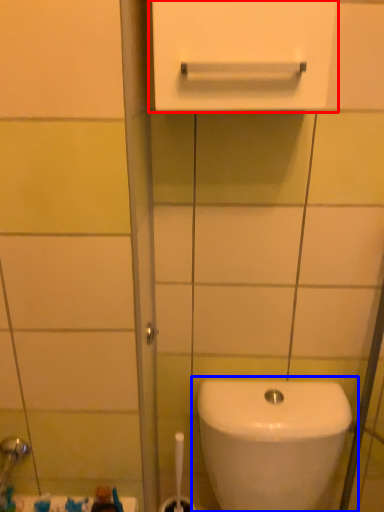
Question: Among these objects, which one is nearest to the camera, medicine cabinet (highlighted by a red box) or toilet (highlighted by a blue box)?

Choices:
 (A) medicine cabinet
 (B) toilet

Answer: (A)